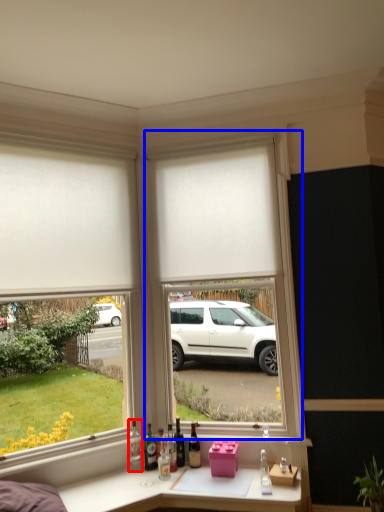
Question: Which object appears farthest to the camera in this image, bottle (highlighted by a red box) or window frame (highlighted by a blue box)?

Choices:
 (A) bottle
 (B) window frame

Answer: (A)